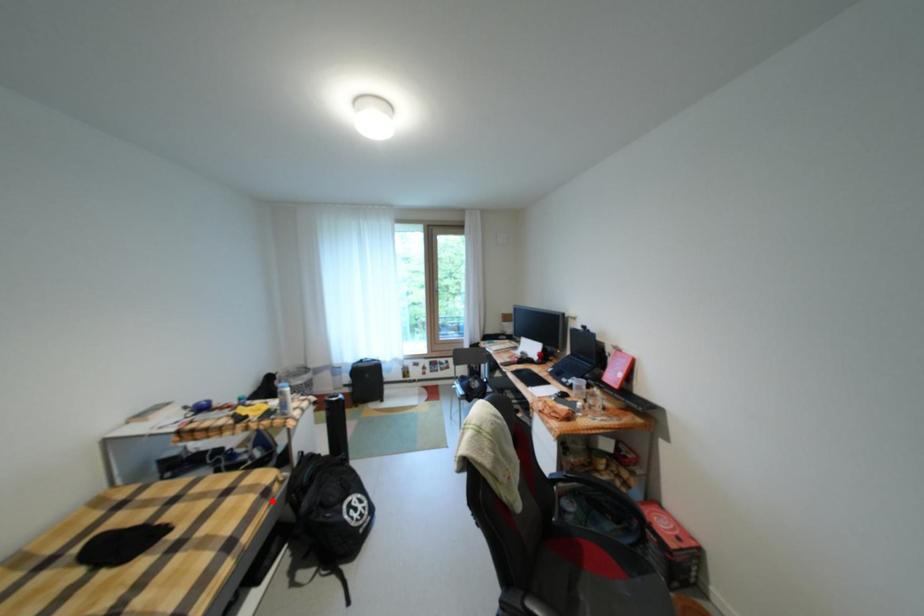
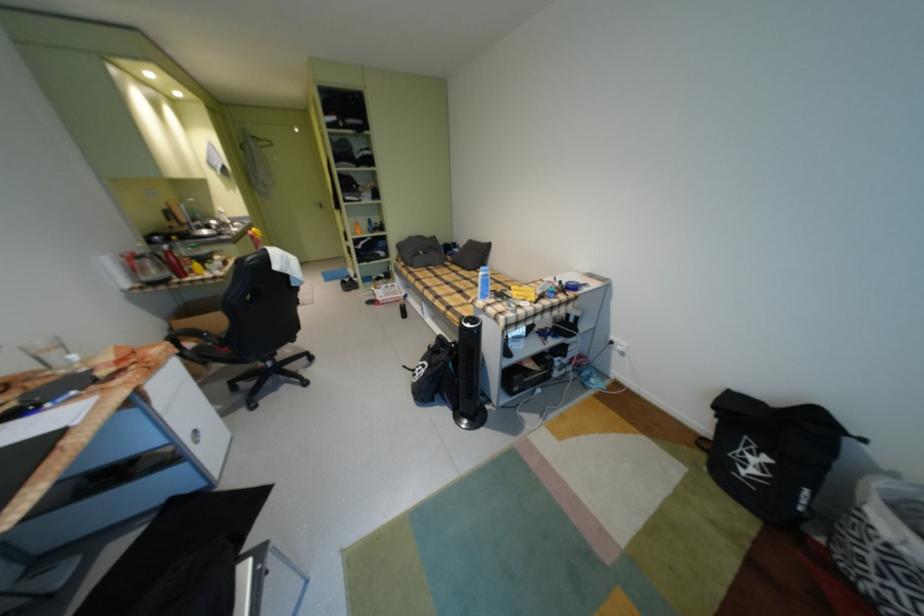
Find the pixel in the second image that matches the highlighted location in the first image.

(470, 318)